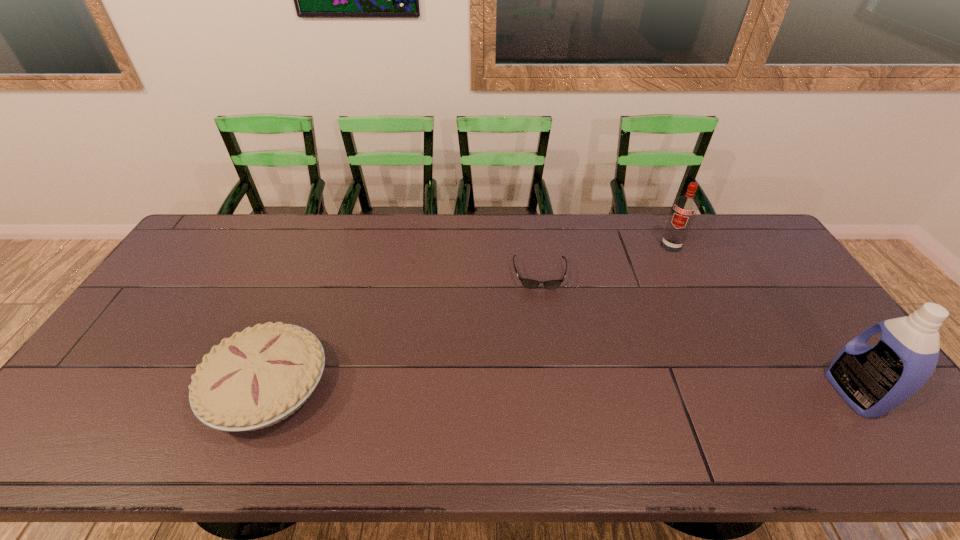
The image size is (960, 540). Identify the location of object that is at the near right corner. (873, 380).

In the image, there is a desktop. Where is `vacant space at the far edge`? vacant space at the far edge is located at coordinates (235, 251).

Where is `vacant region at the near edge of the desktop`? vacant region at the near edge of the desktop is located at coordinates (424, 390).

In the image, there is a desktop. In order to click on vacant region at the right edge in this screenshot , I will do `click(779, 322)`.

Image resolution: width=960 pixels, height=540 pixels. I want to click on vacant space at the far left corner of the desktop, so click(203, 228).

In the image, there is a desktop. Where is `free space at the far right corner`? free space at the far right corner is located at coordinates (768, 248).

Image resolution: width=960 pixels, height=540 pixels. Identify the location of free space between the third object from right to left and the second shortest object. (404, 330).

This screenshot has height=540, width=960. In order to click on free space between the farthest object and the leftmost object in this screenshot , I will do `click(469, 316)`.

Locate an element on the screen. This screenshot has width=960, height=540. vacant space that is in between the third object from left to right and the tallest object is located at coordinates [762, 320].

In order to click on empty location between the tallest object and the third shortest object in this screenshot , I will do `click(762, 320)`.